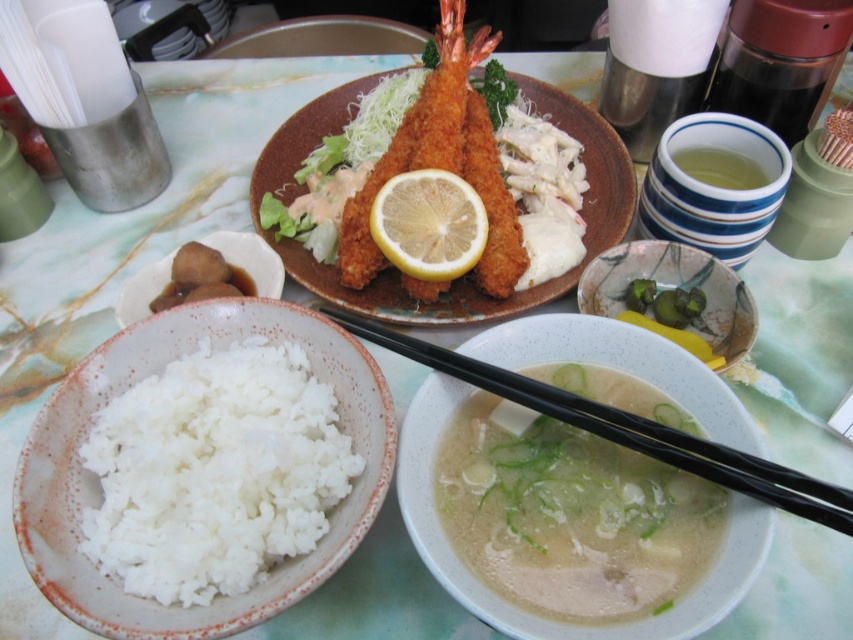
You are a food critic sitting at the table. You need to compare the heights of the black plastic chopsticks at lower right and the translucent glass bowl at upper right. Which object is taller?

The black plastic chopsticks at lower right is taller than the translucent glass bowl at upper right.

You are a person with a height of 5 feet 6 inches. You are sitting at the table and want to pick up the black plastic chopsticks at lower right. Can you comfortably reach them without moving your chair?

The black plastic chopsticks at lower right are 18.12 inches away from the viewer. Since the average comfortable reaching distance for someone of that height is around 24 inches, you can comfortably reach them without moving your chair.